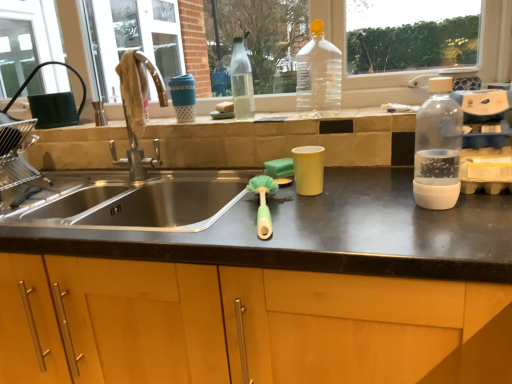
Where is `vacant area that lies between transparent plastic bottle at right, the first bottle from the front, and green rubber brush at center`? vacant area that lies between transparent plastic bottle at right, the first bottle from the front, and green rubber brush at center is located at coordinates (341, 211).